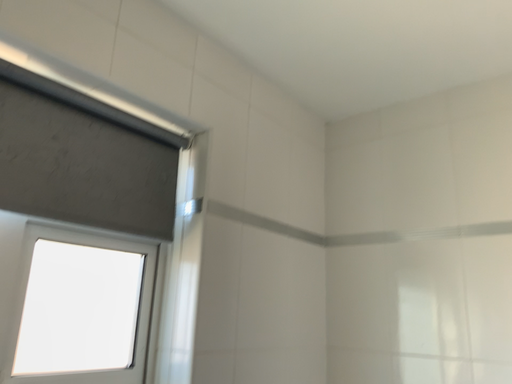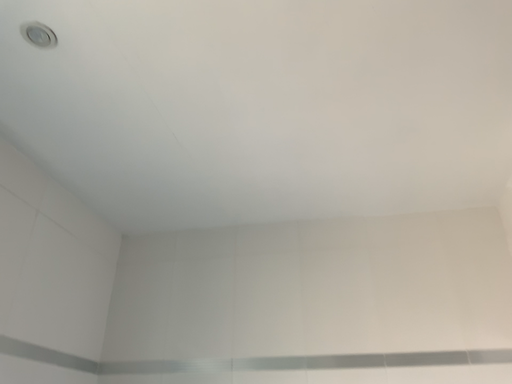
Question: Which way did the camera rotate in the video?

Choices:
 (A) rotated downward
 (B) rotated upward

Answer: (B)